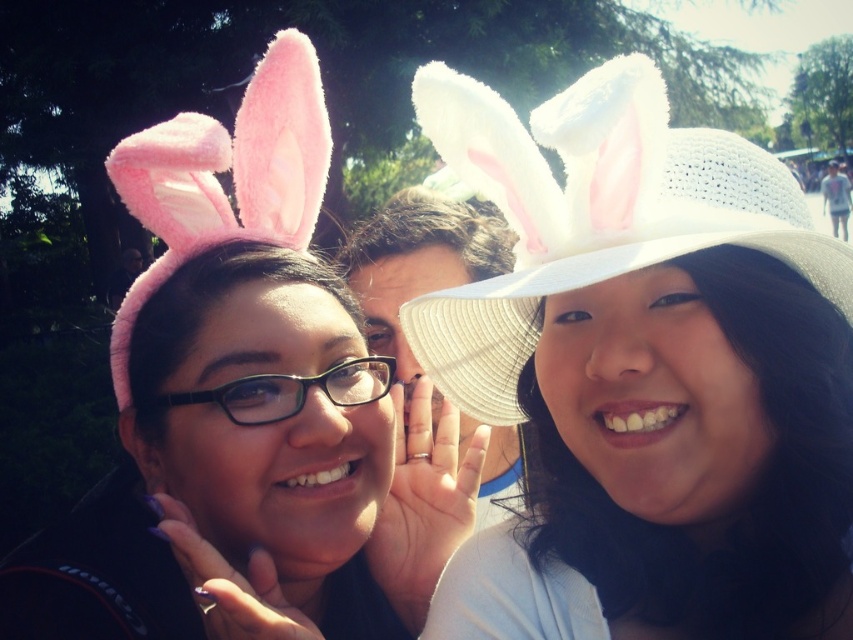
Does pink fluffy hat at left appear over black plastic glasses at center?

Correct, pink fluffy hat at left is located above black plastic glasses at center.

Is point (310, 156) behind point (207, 396)?

Yes, it is.

Where is `pink fluffy hat at left`? pink fluffy hat at left is located at coordinates (231, 177).

Is white woven hat at center taller than black plastic glasses at center?

Correct, white woven hat at center is much taller as black plastic glasses at center.

Does point (447, 282) come in front of point (172, 394)?

No, it is not.

Is point (386, 262) positioned before point (300, 385)?

That is False.

The image size is (853, 640). Identify the location of white woven hat at center. (416, 262).

Is white woven hat at upper right thinner than white woven hat at center?

Incorrect, white woven hat at upper right's width is not less than white woven hat at center's.

Does white woven hat at upper right appear on the left side of white woven hat at center?

Incorrect, white woven hat at upper right is not on the left side of white woven hat at center.

Is point (567, 218) less distant than point (361, 289)?

That is True.

The width and height of the screenshot is (853, 640). Identify the location of white woven hat at upper right. (590, 212).